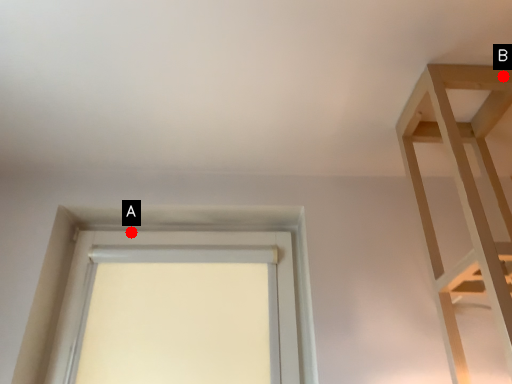
Question: Two points are circled on the image, labeled by A and B beside each circle. Among these points, which one is nearest to the camera?

Choices:
 (A) A is closer
 (B) B is closer

Answer: (B)